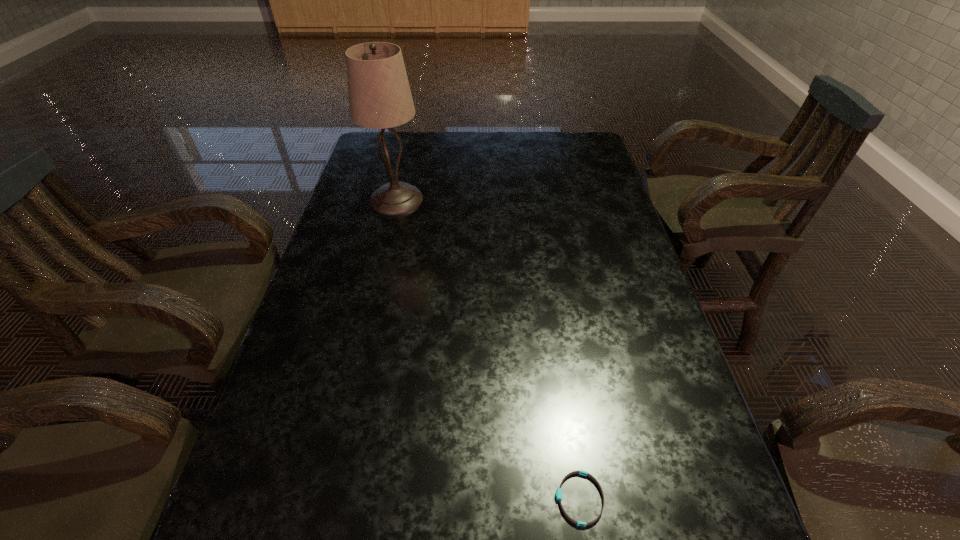
At what (x,y) coordinates should I click in order to perform the action: click on the farther object. Please return your answer as a coordinate pair (x, y). Looking at the image, I should click on (380, 97).

Locate an element on the screen. The height and width of the screenshot is (540, 960). the left object is located at coordinates (380, 97).

You are a GUI agent. You are given a task and a screenshot of the screen. Output one action in this format:
    pyautogui.click(x=<x>, y=<y>)
    Task: Click on the wristband
    
    Given the screenshot: What is the action you would take?
    pyautogui.click(x=558, y=494)

This screenshot has height=540, width=960. What are the coordinates of `the nearer object` in the screenshot? It's located at (558, 494).

I want to click on vacant area located 0.170m on the front-facing side of the taller object, so pos(384,254).

Where is `free spot located 0.130m on the buckle of the right object`? Image resolution: width=960 pixels, height=540 pixels. free spot located 0.130m on the buckle of the right object is located at coordinates (479, 498).

I want to click on free point located 0.250m on the buckle of the right object, so click(x=410, y=498).

Locate an element on the screen. This screenshot has width=960, height=540. vacant space positioned 0.200m on the buckle of the right object is located at coordinates click(439, 498).

Where is `object that is at the left edge`? The width and height of the screenshot is (960, 540). object that is at the left edge is located at coordinates 380,97.

Identify the location of vacant space at the far edge of the desktop. Image resolution: width=960 pixels, height=540 pixels. (547, 140).